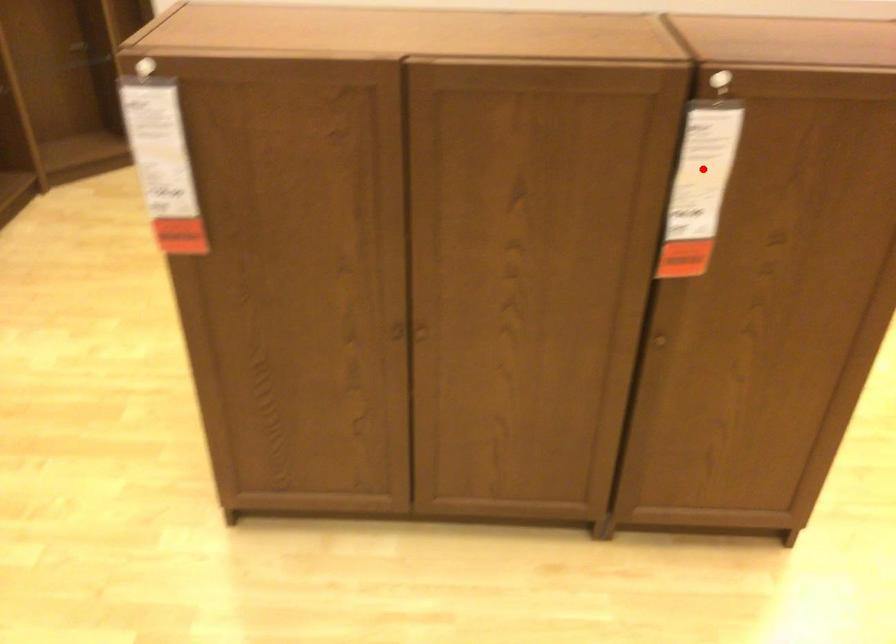
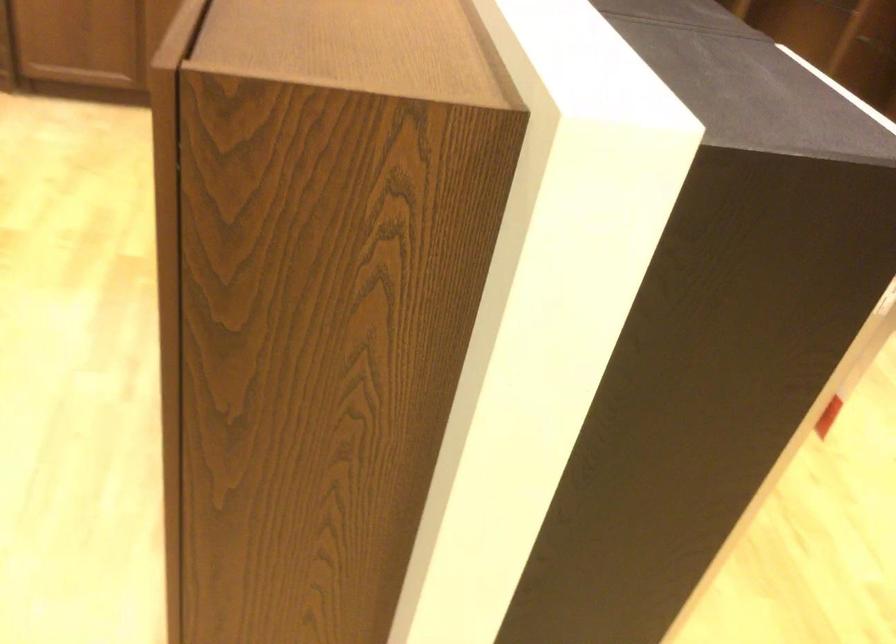
Question: I am providing you with two images of the same scene from different viewpoints. A red point is marked on the first image. Is the red point's position out of view in image 2?

Choices:
 (A) Yes
 (B) No

Answer: (A)